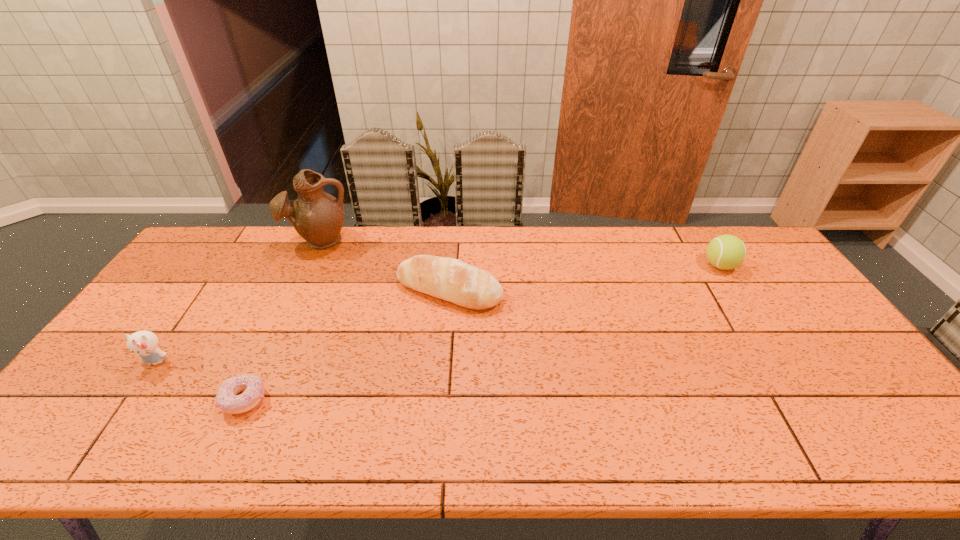
The image size is (960, 540). What are the coordinates of `pitcher` in the screenshot? It's located at (317, 216).

Where is `the rightmost object`? the rightmost object is located at coordinates (725, 252).

This screenshot has width=960, height=540. In order to click on the leftmost object in this screenshot , I will do `click(143, 343)`.

This screenshot has width=960, height=540. Find the location of `kitten`. kitten is located at coordinates (143, 343).

Identify the location of bread. The height and width of the screenshot is (540, 960). (449, 279).

Identify the location of the shortest object. The width and height of the screenshot is (960, 540). (252, 386).

Where is `doughnut`? The image size is (960, 540). doughnut is located at coordinates (252, 386).

This screenshot has height=540, width=960. I want to click on vacant space located 0.310m at the spout of the pitcher, so click(x=282, y=322).

Locate an element on the screen. free space located 0.100m on the right of the rightmost object is located at coordinates (767, 266).

The height and width of the screenshot is (540, 960). Identify the location of vacant position located 0.230m on the front-facing side of the leftmost object. (89, 456).